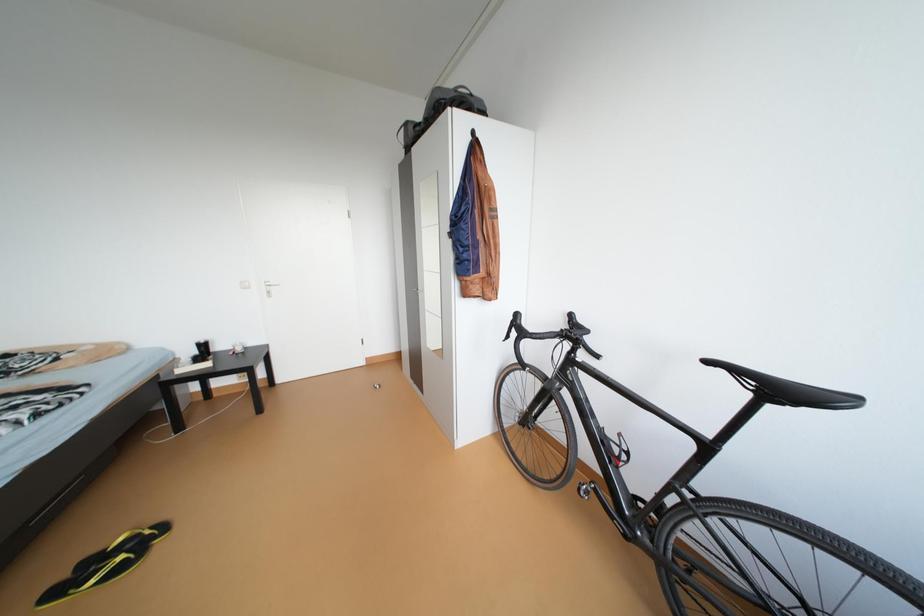
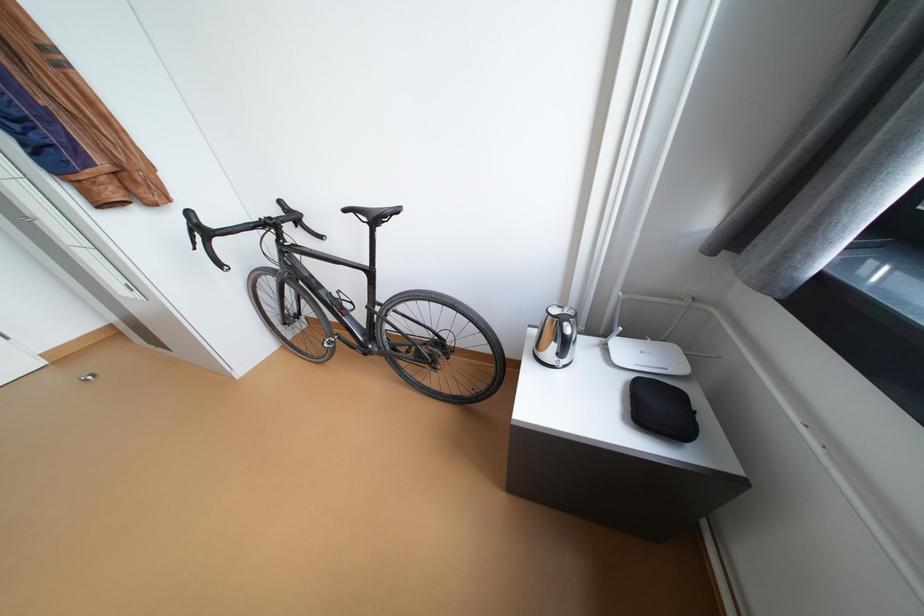
First-person continuous shooting, in which direction is the camera rotating?

The rotation direction of the camera is right-down.